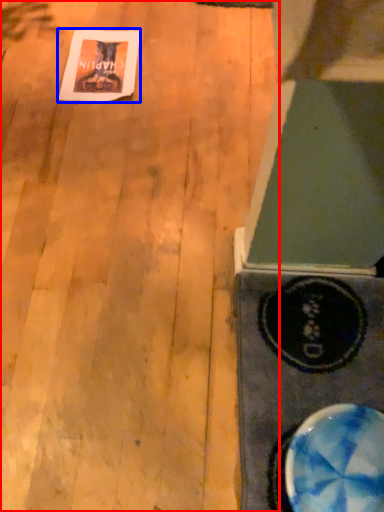
Question: Which point is closer to the camera, plywood (highlighted by a red box) or postcard (highlighted by a blue box)?

Choices:
 (A) plywood
 (B) postcard

Answer: (A)